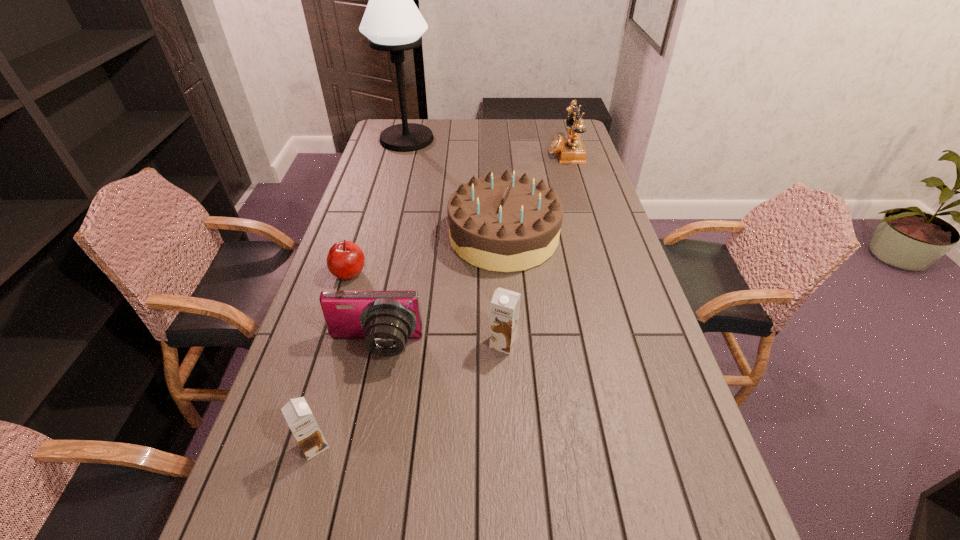
The height and width of the screenshot is (540, 960). What are the coordinates of `the sixth closest object to the camera` in the screenshot? It's located at (392, 22).

You are a GUI agent. You are given a task and a screenshot of the screen. Output one action in this format:
    pyautogui.click(x=<x>, y=<y>)
    Task: Click on the vacant region that satisfies the following two spatial constraints: 1. on the front-facing side of the birthday cake; 2. on the front-facing side of the camera
    This screenshot has width=960, height=540.
    Given the screenshot: What is the action you would take?
    pyautogui.click(x=511, y=347)

You are a GUI agent. You are given a task and a screenshot of the screen. Output one action in this format:
    pyautogui.click(x=<x>, y=<y>)
    Task: Click on the blank space that satisfies the following two spatial constraints: 1. on the front-facing side of the birthday cake; 2. on the front-facing side of the camera
    
    Given the screenshot: What is the action you would take?
    pyautogui.click(x=511, y=347)

Find the location of `vacant space that satisfies the following two spatial constraints: 1. on the dial number of the rightmost object; 2. on the front-facing side of the camera`. vacant space that satisfies the following two spatial constraints: 1. on the dial number of the rightmost object; 2. on the front-facing side of the camera is located at coordinates (623, 347).

You are a GUI agent. You are given a task and a screenshot of the screen. Output one action in this format:
    pyautogui.click(x=<x>, y=<y>)
    Task: Click on the blank space that satisfies the following two spatial constraints: 1. on the dial number of the rightmost object; 2. on the front-facing side of the camera
    The width and height of the screenshot is (960, 540).
    Given the screenshot: What is the action you would take?
    pyautogui.click(x=623, y=347)

Where is `vacant position in the image that satisfies the following two spatial constraints: 1. on the front-facing side of the birthday cake; 2. on the front side of the shorter chocolate milk`? The height and width of the screenshot is (540, 960). vacant position in the image that satisfies the following two spatial constraints: 1. on the front-facing side of the birthday cake; 2. on the front side of the shorter chocolate milk is located at coordinates (517, 446).

You are a GUI agent. You are given a task and a screenshot of the screen. Output one action in this format:
    pyautogui.click(x=<x>, y=<y>)
    Task: Click on the vacant space that satisfies the following two spatial constraints: 1. on the dial number of the rightmost object; 2. on the front side of the taller chocolate milk
    This screenshot has width=960, height=540.
    Given the screenshot: What is the action you would take?
    pyautogui.click(x=622, y=343)